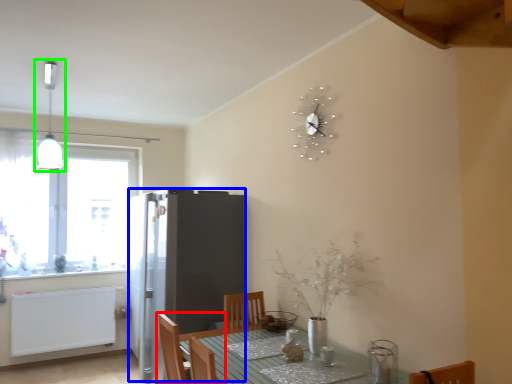
Question: Based on their relative distances, which object is nearer to chair (highlighted by a red box)? Choose from fridge (highlighted by a blue box) and light fixture (highlighted by a green box).

Choices:
 (A) fridge
 (B) light fixture

Answer: (A)